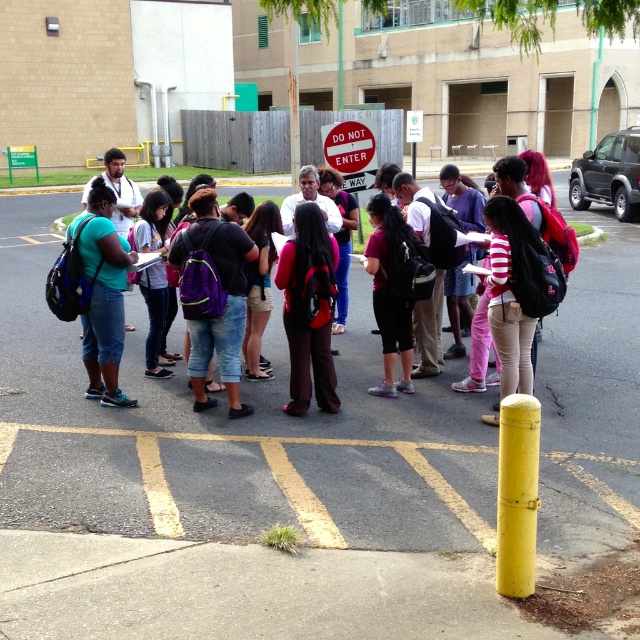
Question: Is yellow asphalt parking line at lower center bigger than red matte stop sign at center?

Choices:
 (A) yes
 (B) no

Answer: (B)

Question: In this image, where is matte black backpack at center located relative to red matte stop sign at center?

Choices:
 (A) right
 (B) left

Answer: (A)

Question: Can you confirm if yellow asphalt parking line at lower center is positioned below red matte stop sign at center?

Choices:
 (A) yes
 (B) no

Answer: (A)

Question: Among these objects, which one is nearest to the camera?

Choices:
 (A) red matte stop sign at center
 (B) matte black backpack at center

Answer: (B)

Question: Which is nearer to the matte black backpack at center?

Choices:
 (A) red matte stop sign at center
 (B) yellow asphalt parking line at lower center

Answer: (B)

Question: Which point appears farthest from the camera in this image?

Choices:
 (A) (588, 476)
 (B) (340, 164)

Answer: (B)